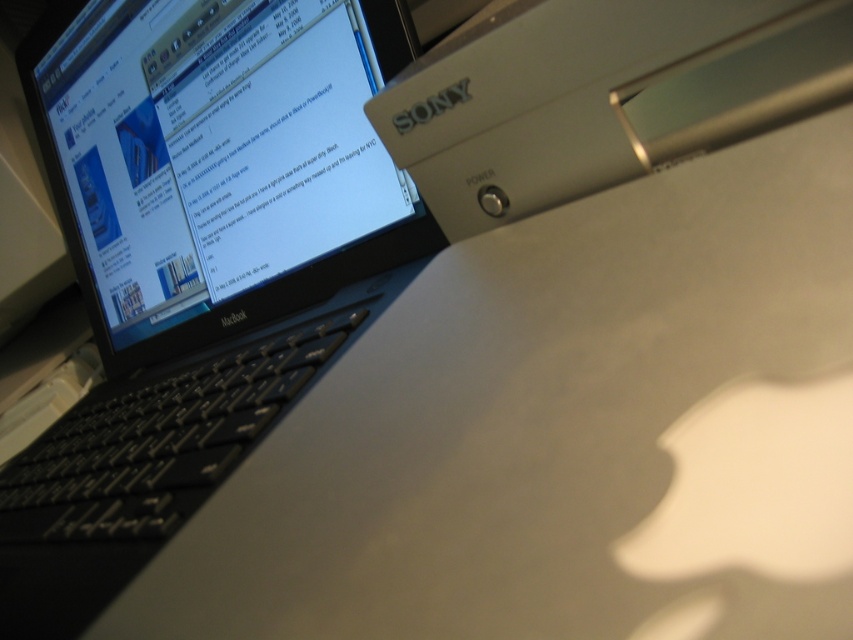
Question: Which of the following is the closest to the observer?

Choices:
 (A) satin silver power supply at upper right
 (B) matte black laptop at upper left

Answer: (A)

Question: Which of the following is the farthest from the observer?

Choices:
 (A) (592, 182)
 (B) (328, 141)

Answer: (B)

Question: Can you confirm if matte black laptop at upper left is positioned to the left of satin silver power supply at upper right?

Choices:
 (A) no
 (B) yes

Answer: (B)

Question: Is matte black laptop at upper left wider than satin silver power supply at upper right?

Choices:
 (A) no
 (B) yes

Answer: (B)

Question: Is matte black laptop at upper left bigger than satin silver power supply at upper right?

Choices:
 (A) yes
 (B) no

Answer: (A)